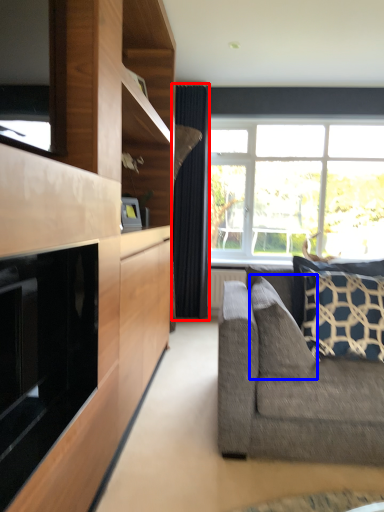
Question: Which object appears closest to the camera in this image, curtain (highlighted by a red box) or pillow (highlighted by a blue box)?

Choices:
 (A) curtain
 (B) pillow

Answer: (B)